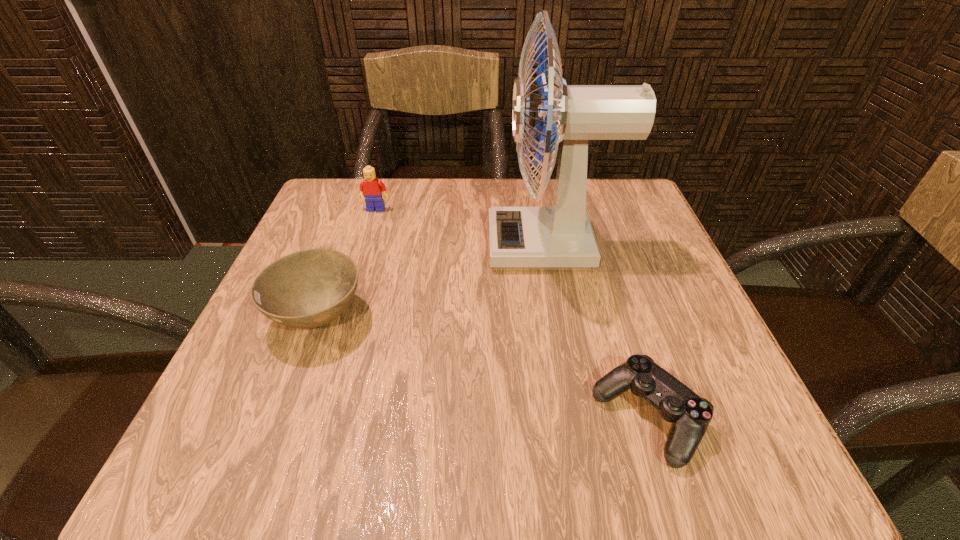
Find the location of a particular element. This screenshot has height=540, width=960. free location that satisfies the following two spatial constraints: 1. on the face of the Lego; 2. on the right side of the nearest object is located at coordinates (310, 418).

Find the location of a particular element. vacant area in the image that satisfies the following two spatial constraints: 1. on the front-facing side of the fan; 2. on the left side of the shortest object is located at coordinates (584, 418).

Locate an element on the screen. vacant area in the image that satisfies the following two spatial constraints: 1. on the face of the control; 2. on the right side of the Lego is located at coordinates (310, 418).